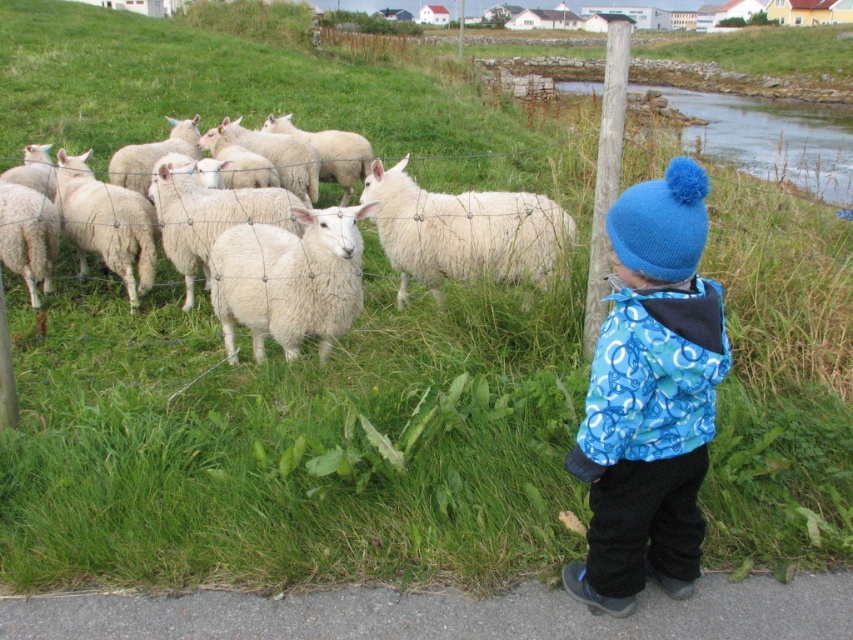
You are a farmer checking the sheep in the pasture. You notice the white woolly sheep at left and the white woolly sheep at center. Which one is taller?

The white woolly sheep at left is taller than the white woolly sheep at center.

You are a photographer standing at the edge of the grassy area. You want to take a photo of the blue knitted hat at upper right and the white woolen sheep at center. If your camera can focus on objects within 5 feet, will both subjects be in focus?

The blue knitted hat at upper right is 5.72 feet from the white woolen sheep at center. Since the distance between them is greater than 5 feet, the camera may not be able to keep both in focus simultaneously.

You are a photographer trying to capture a photo of the white woolly sheep at left and the white woolly sheep at center. From the photographer perspective, which sheep is positioned higher in the image?

The white woolly sheep at left is positioned higher in the image than the white woolly sheep at center.